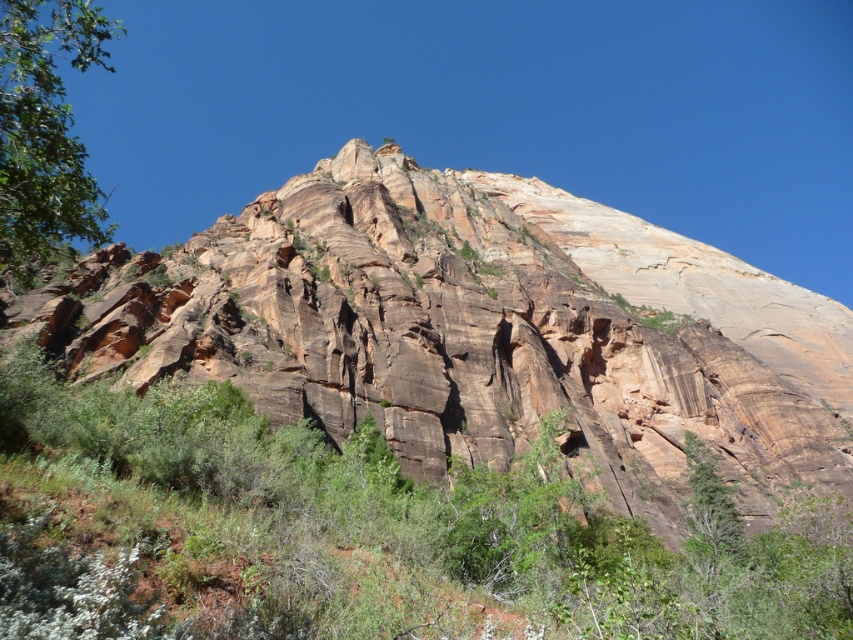
Does rustic rock cliff at center appear on the left side of green leafy shrubs at center?

Incorrect, rustic rock cliff at center is not on the left side of green leafy shrubs at center.

Does rustic rock cliff at center appear on the right side of green leafy shrubs at center?

Correct, you'll find rustic rock cliff at center to the right of green leafy shrubs at center.

This screenshot has height=640, width=853. In order to click on rustic rock cliff at center in this screenshot , I will do `click(476, 332)`.

From the picture: Can you confirm if green leafy shrubs at center is thinner than green leafy tree at left?

Correct, green leafy shrubs at center's width is less than green leafy tree at left's.

Is the position of green leafy shrubs at center more distant than that of green leafy tree at left?

No, it is not.

Who is more forward, [647,536] or [30,147]?

Positioned in front is point [30,147].

This screenshot has height=640, width=853. Find the location of `green leafy shrubs at center`. green leafy shrubs at center is located at coordinates (358, 532).

Between rustic rock cliff at center and green leafy tree at left, which one has less height?

rustic rock cliff at center

The width and height of the screenshot is (853, 640). Find the location of `rustic rock cliff at center`. rustic rock cliff at center is located at coordinates (476, 332).

Describe the element at coordinates (476, 332) in the screenshot. I see `rustic rock cliff at center` at that location.

This screenshot has width=853, height=640. What are the coordinates of `rustic rock cliff at center` in the screenshot? It's located at point(476,332).